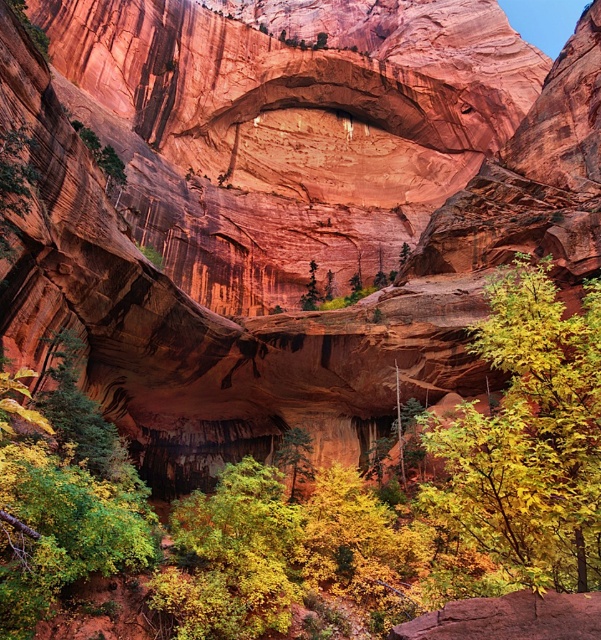
Is point (49, 472) positioned in front of point (590, 602)?

No, it is not.

What do you see at coordinates (66, 499) in the screenshot?
I see `yellow-green foliage at lower left` at bounding box center [66, 499].

At what (x,y) coordinates should I click in order to perform the action: click on yellow-green foliage at lower left. Please return your answer as a coordinate pair (x, y). The height and width of the screenshot is (640, 601). Looking at the image, I should click on (66, 499).

Does reddish-brown rock at lower center come behind green matte tree at center?

No, it is not.

Which of these two, reddish-brown rock at lower center or green matte tree at center, stands taller?

green matte tree at center

Between point (462, 609) and point (291, 500), which one is positioned in front?

Point (462, 609) is more forward.

You are a GUI agent. You are given a task and a screenshot of the screen. Output one action in this format:
    pyautogui.click(x=<x>, y=<y>)
    Task: Click on the reddish-brown rock at lower center
    This screenshot has height=640, width=601.
    Given the screenshot: What is the action you would take?
    pyautogui.click(x=510, y=618)

Can you confirm if yellow-green foliage at center is positioned above green matte tree at center?

Actually, yellow-green foliage at center is below green matte tree at center.

Between yellow-green foliage at center and green matte tree at center, which one has more height?

yellow-green foliage at center is taller.

Who is more distant from viewer, (x=263, y=586) or (x=304, y=436)?

Positioned behind is point (x=304, y=436).

At what (x,y) coordinates should I click in order to perform the action: click on yellow-green foliage at center. Please return your answer as a coordinate pair (x, y). The image size is (601, 640). Looking at the image, I should click on (231, 557).